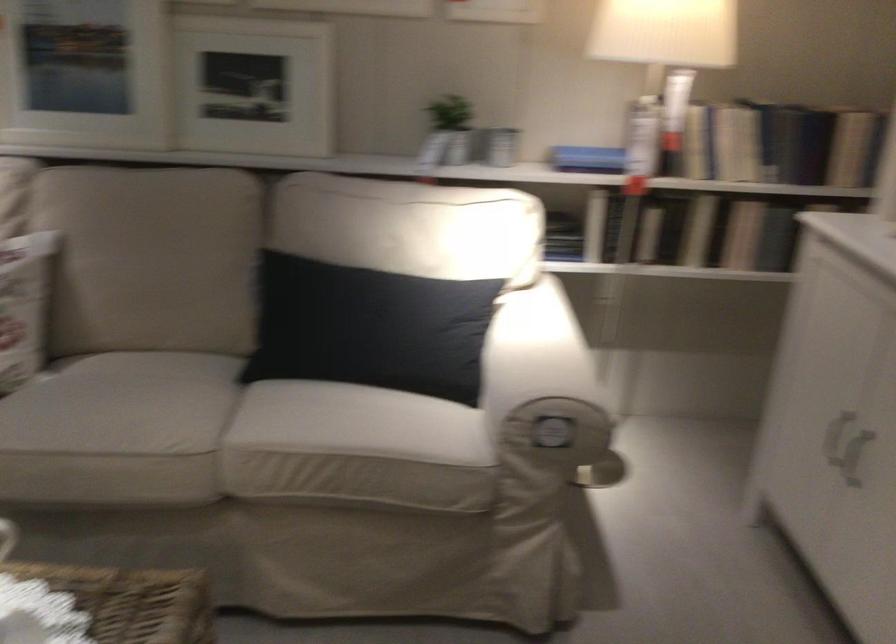
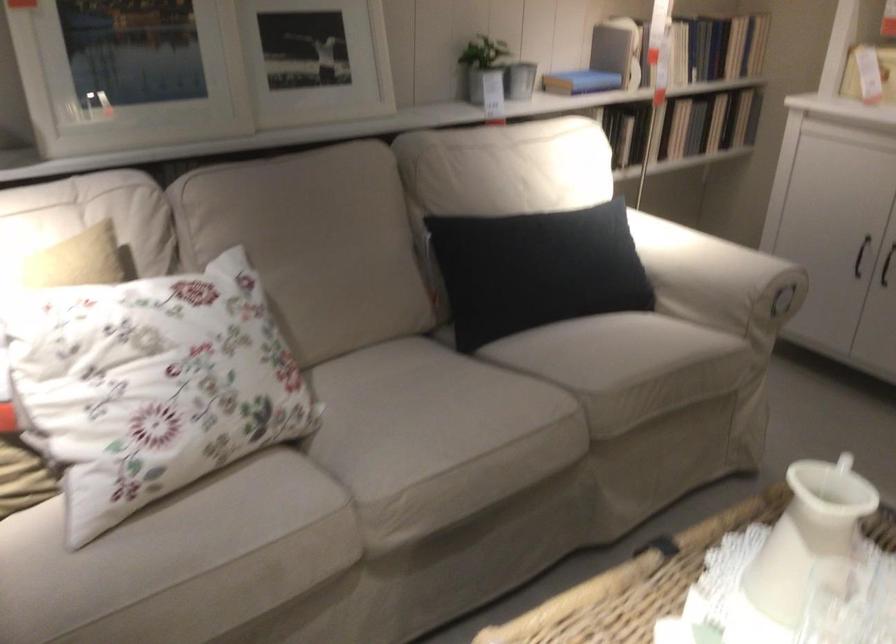
Locate, in the second image, the point that corresponds to pixel 574 156 in the first image.

(580, 82)